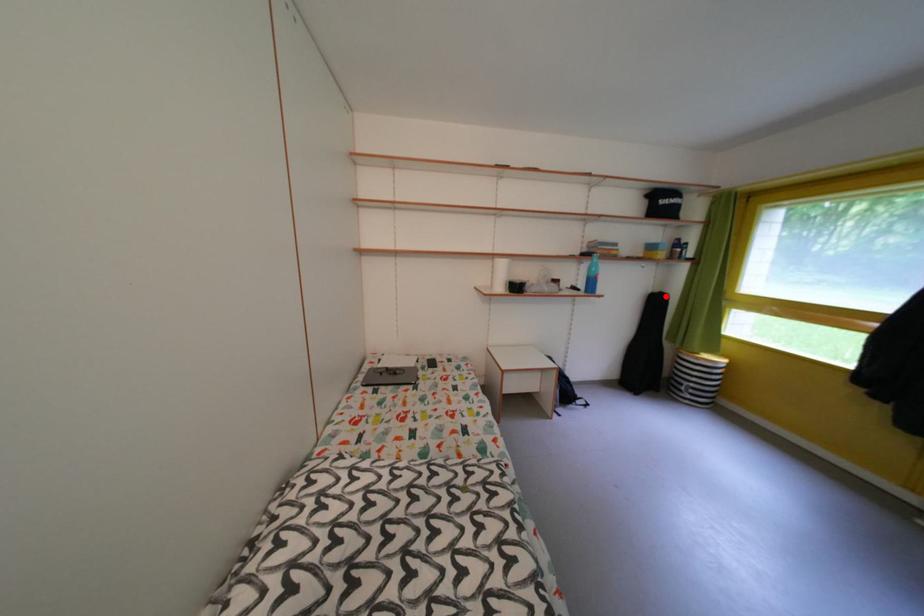
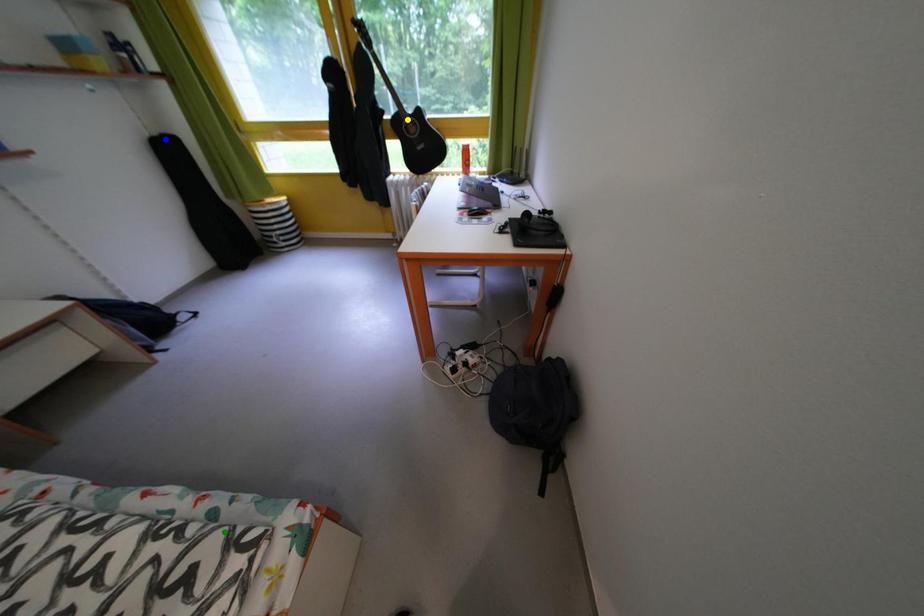
Question: I am providing you with two images of the same scene from different viewpoints. A red point is marked on the first image. You are given multiple points on the second image. Can you choose the point in image 2 that corresponds to the point in image 1?

Choices:
 (A) yellow point
 (B) blue point
 (C) green point

Answer: (B)